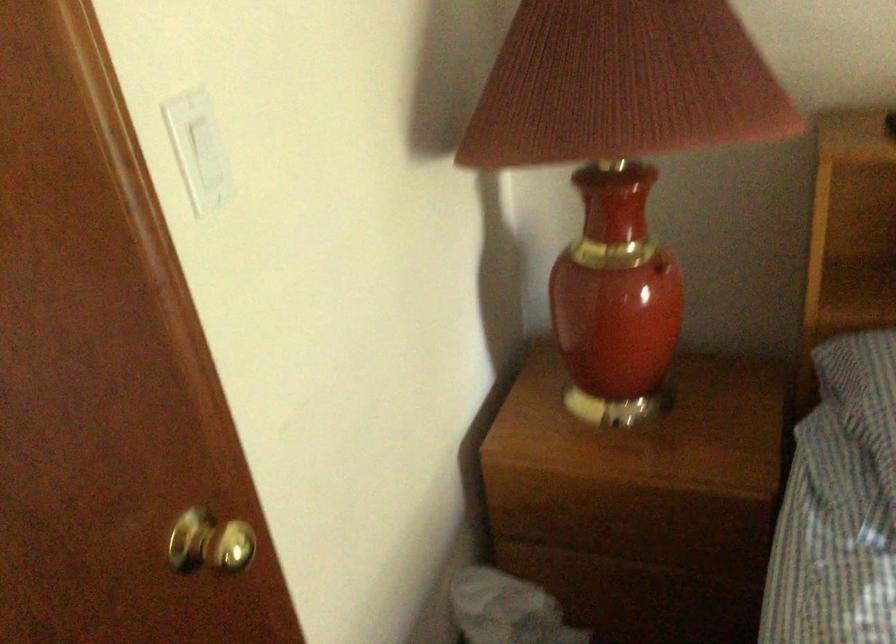
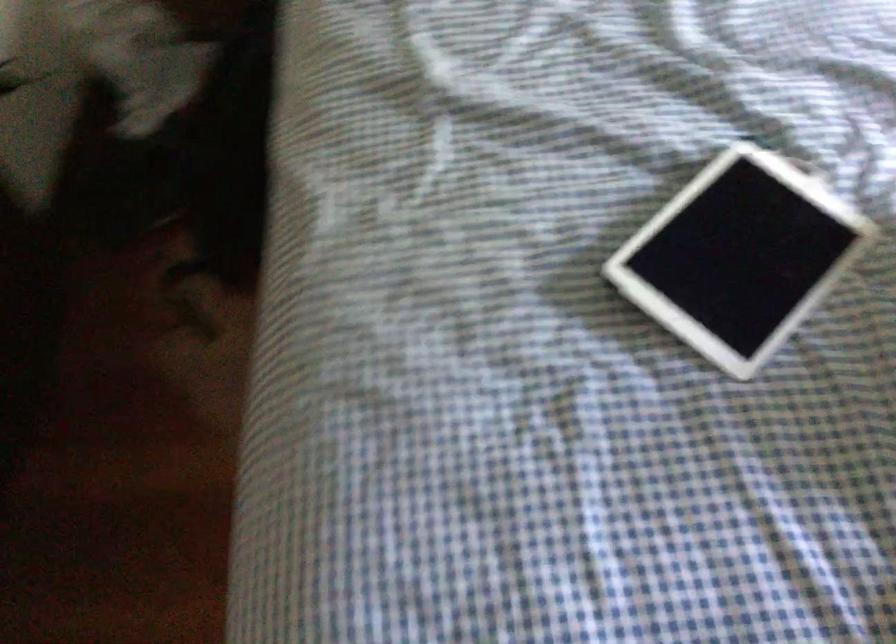
How did the camera likely rotate?

The rotation direction of the camera is right-down.